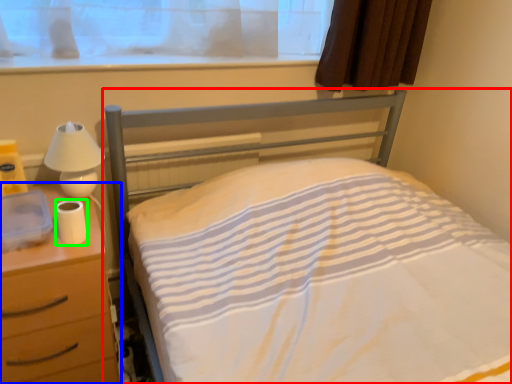
Question: Which is farther away from bed (highlighted by a red box)? nightstand (highlighted by a blue box) or toilet paper (highlighted by a green box)?

Choices:
 (A) nightstand
 (B) toilet paper

Answer: (B)